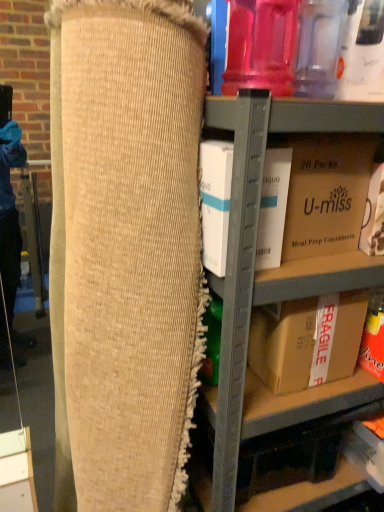
Question: Is white cardboard box at center, marked as the 2th box in a back-to-front arrangement, wider or thinner than brown cardboard box at lower right, arranged as the first box when ordered from the bottom?

Choices:
 (A) wide
 (B) thin

Answer: (B)

Question: Would you say white cardboard box at center, marked as the 2th box in a back-to-front arrangement, is to the left or to the right of brown cardboard box at lower right, marked as the second box in a front-to-back arrangement, in the picture?

Choices:
 (A) right
 (B) left

Answer: (B)

Question: Which object is the closest to the cardboard box at center?

Choices:
 (A) brown cardboard box at lower right, the 1th box viewed from the back
 (B) white cardboard box at center, the 2th box positioned from the bottom
 (C) matte cardboard box at lower right, placed as the second storage box when sorted from top to bottom
 (D) natural burlap bean bag chair at center
 (E) brown cardboard box at upper right, marked as the second storage box in a right-to-left arrangement

Answer: (E)

Question: Which is nearer to the matte cardboard box at lower right, which appears as the 1th storage box when ordered from the bottom?

Choices:
 (A) cardboard box at center
 (B) white cardboard box at center, the 1th box in the top-to-bottom sequence
 (C) natural burlap bean bag chair at center
 (D) brown cardboard box at lower right, marked as the second box in a front-to-back arrangement
 (E) brown cardboard box at upper right, marked as the 2th storage box in a bottom-to-top arrangement

Answer: (D)